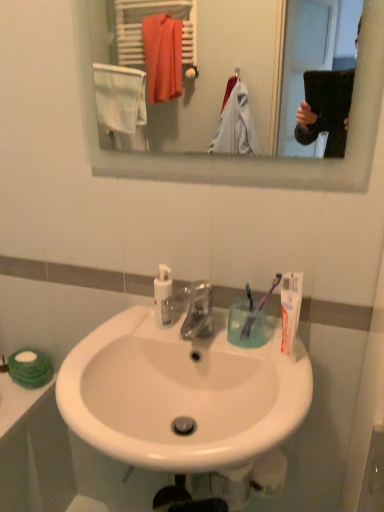
Question: Should I look upward or downward to see clear glass mirror at upper center?

Choices:
 (A) up
 (B) down

Answer: (A)

Question: From the image's perspective, is translucent plastic cup at sink above clear glass mirror at upper center?

Choices:
 (A) yes
 (B) no

Answer: (B)

Question: Considering the relative sizes of translucent plastic cup at sink and clear glass mirror at upper center in the image provided, is translucent plastic cup at sink taller than clear glass mirror at upper center?

Choices:
 (A) yes
 (B) no

Answer: (B)

Question: Is clear glass mirror at upper center inside translucent plastic cup at sink?

Choices:
 (A) yes
 (B) no

Answer: (B)

Question: Does translucent plastic cup at sink appear on the right side of clear glass mirror at upper center?

Choices:
 (A) no
 (B) yes

Answer: (B)

Question: Is translucent plastic cup at sink shorter than clear glass mirror at upper center?

Choices:
 (A) no
 (B) yes

Answer: (B)

Question: Does translucent plastic cup at sink come behind clear glass mirror at upper center?

Choices:
 (A) yes
 (B) no

Answer: (A)

Question: Can you confirm if purple plastic toothbrush at right, positioned as the 1th toothbrush in left-to-right order, is positioned to the right of purple plastic toothbrush at right, acting as the 2th toothbrush starting from the left?

Choices:
 (A) yes
 (B) no

Answer: (B)

Question: Is the depth of purple plastic toothbrush at right, positioned as the 1th toothbrush in left-to-right order, greater than that of purple plastic toothbrush at right, marked as the first toothbrush in a right-to-left arrangement?

Choices:
 (A) yes
 (B) no

Answer: (A)

Question: From the image's perspective, would you say purple plastic toothbrush at right, the second toothbrush in the right-to-left sequence, is shown under purple plastic toothbrush at right, marked as the first toothbrush in a right-to-left arrangement?

Choices:
 (A) yes
 (B) no

Answer: (A)

Question: Is purple plastic toothbrush at right, positioned as the 1th toothbrush in left-to-right order, taller than purple plastic toothbrush at right, acting as the 2th toothbrush starting from the left?

Choices:
 (A) yes
 (B) no

Answer: (B)

Question: Considering the relative sizes of purple plastic toothbrush at right, the second toothbrush in the right-to-left sequence, and purple plastic toothbrush at right, acting as the 2th toothbrush starting from the left, in the image provided, is purple plastic toothbrush at right, the second toothbrush in the right-to-left sequence, wider than purple plastic toothbrush at right, acting as the 2th toothbrush starting from the left,?

Choices:
 (A) no
 (B) yes

Answer: (A)

Question: Is purple plastic toothbrush at right, positioned as the 1th toothbrush in left-to-right order, smaller than purple plastic toothbrush at right, acting as the 2th toothbrush starting from the left?

Choices:
 (A) yes
 (B) no

Answer: (A)

Question: Does clear glass mirror at upper center appear on the right side of white matte tube of toothpaste at right?

Choices:
 (A) no
 (B) yes

Answer: (A)